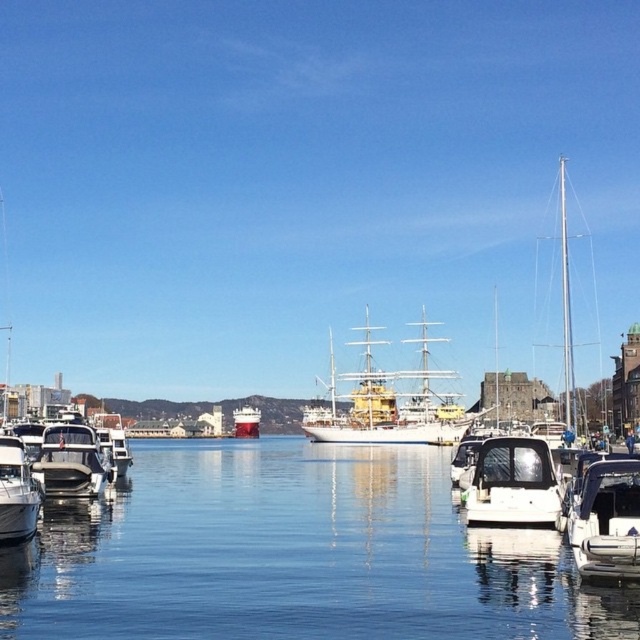
Where is `white wooden ship at center`? This screenshot has width=640, height=640. white wooden ship at center is located at coordinates (396, 401).

Does white wooden ship at center have a smaller size compared to white glossy boat at lower right?

No.

Where is `white wooden ship at center`? white wooden ship at center is located at coordinates (396, 401).

Where is `white wooden ship at center`? The height and width of the screenshot is (640, 640). white wooden ship at center is located at coordinates (396, 401).

Can you confirm if white matte boat at center is smaller than matte black boat at left?

Yes, white matte boat at center is smaller than matte black boat at left.

The height and width of the screenshot is (640, 640). What do you see at coordinates (513, 484) in the screenshot?
I see `white matte boat at center` at bounding box center [513, 484].

At what (x,y) coordinates should I click in order to perform the action: click on white matte boat at center. Please return your answer as a coordinate pair (x, y). Image resolution: width=640 pixels, height=640 pixels. Looking at the image, I should click on (513, 484).

Based on the photo, who is more distant from viewer, [557,620] or [60,486]?

Positioned behind is point [60,486].

Find the location of a particular element. The width and height of the screenshot is (640, 640). clear water at center is located at coordinates (294, 554).

Where is `clear water at center`? The image size is (640, 640). clear water at center is located at coordinates (294, 554).